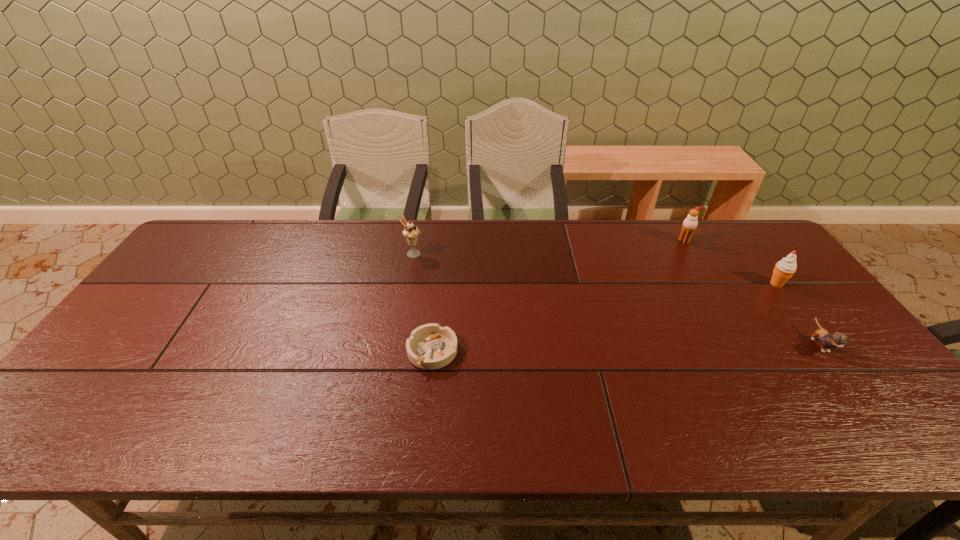
This screenshot has width=960, height=540. I want to click on vacant region located at the front with a straw on the third object from left to right, so click(x=715, y=295).

The height and width of the screenshot is (540, 960). I want to click on vacant space located 0.380m on the left of the third farthest object, so click(x=640, y=284).

Identify the location of free space located 0.060m on the front-facing side of the fourth tallest object. The height and width of the screenshot is (540, 960). (848, 382).

The width and height of the screenshot is (960, 540). Identify the location of vacant space situated 0.150m on the back of the second object from left to right. (439, 293).

I want to click on icecream positioned at the right edge, so click(784, 269).

Find the location of a particular element. The width and height of the screenshot is (960, 540). kitten that is at the right edge is located at coordinates (837, 339).

Locate an element on the screen. The width and height of the screenshot is (960, 540). vacant area at the far edge is located at coordinates (657, 225).

Identify the location of free space at the near edge of the desktop. (156, 415).

The width and height of the screenshot is (960, 540). I want to click on free space at the right edge of the desktop, so click(x=784, y=342).

Identify the location of free space at the far right corner. (736, 242).